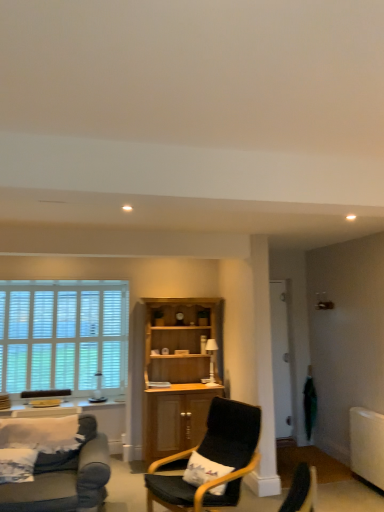
Question: Is transparent glass door at center-right far from matte black armchair at lower left?

Choices:
 (A) no
 (B) yes

Answer: (B)

Question: Is transparent glass door at center-right to the left of matte black armchair at lower left from the viewer's perspective?

Choices:
 (A) no
 (B) yes

Answer: (A)

Question: Is transparent glass door at center-right positioned beyond the bounds of matte black armchair at lower left?

Choices:
 (A) no
 (B) yes

Answer: (B)

Question: Does transparent glass door at center-right contain matte black armchair at lower left?

Choices:
 (A) yes
 (B) no

Answer: (B)

Question: Is transparent glass door at center-right thinner than matte black armchair at lower left?

Choices:
 (A) no
 (B) yes

Answer: (A)

Question: Is point (185, 297) positioned closer to the camera than point (51, 393)?

Choices:
 (A) farther
 (B) closer

Answer: (B)

Question: In terms of height, does wooden cabinet at center look taller or shorter compared to matte black armchair at lower left?

Choices:
 (A) short
 (B) tall

Answer: (B)

Question: From a real-world perspective, is wooden cabinet at center positioned above or below matte black armchair at lower left?

Choices:
 (A) above
 (B) below

Answer: (A)

Question: From the image's perspective, is wooden cabinet at center positioned above or below matte black armchair at lower left?

Choices:
 (A) above
 (B) below

Answer: (A)

Question: Relative to matte black armchair at lower left, is black fabric chair at center in front or behind?

Choices:
 (A) behind
 (B) front

Answer: (B)

Question: Is black fabric chair at center to the left or to the right of matte black armchair at lower left in the image?

Choices:
 (A) left
 (B) right

Answer: (B)

Question: Is point (190, 449) positioned closer to the camera than point (43, 390)?

Choices:
 (A) farther
 (B) closer

Answer: (B)

Question: From a real-world perspective, is black fabric chair at center above or below matte black armchair at lower left?

Choices:
 (A) below
 (B) above

Answer: (A)

Question: Do you think wooden cabinet at center is within white wooden blinds at left, or outside of it?

Choices:
 (A) inside
 (B) outside

Answer: (B)

Question: Is wooden cabinet at center taller or shorter than white wooden blinds at left?

Choices:
 (A) short
 (B) tall

Answer: (B)